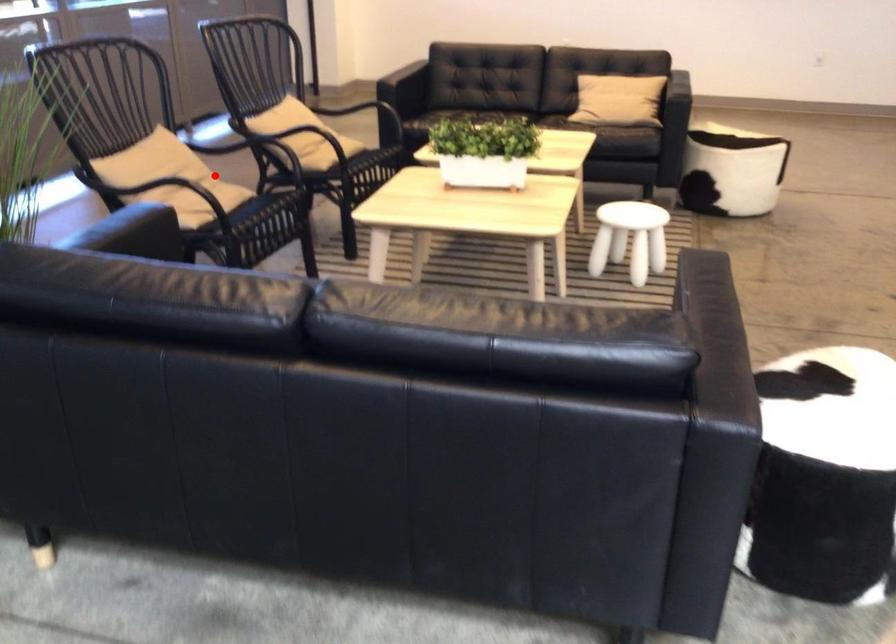
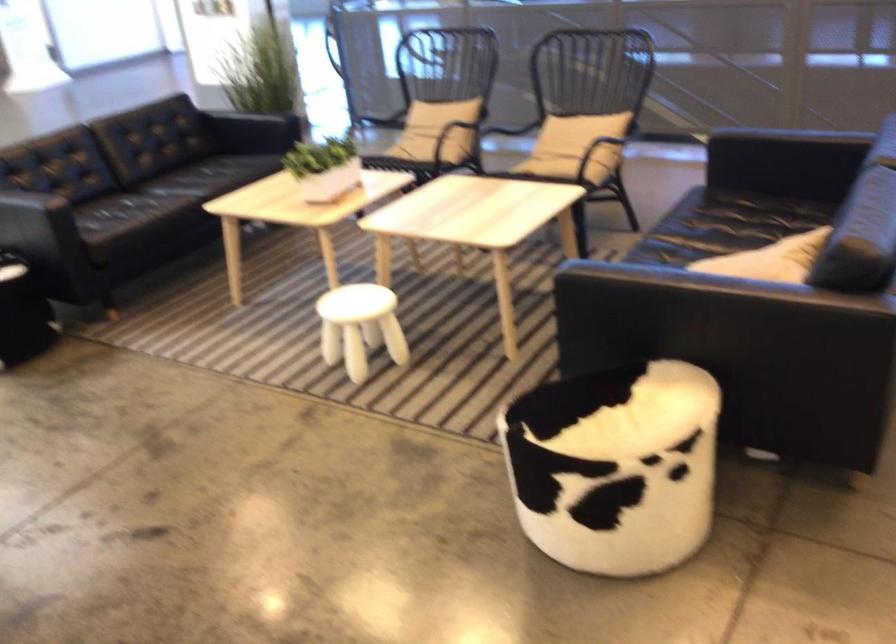
Find the pixel in the second image that matches the highlighted location in the first image.

(440, 128)